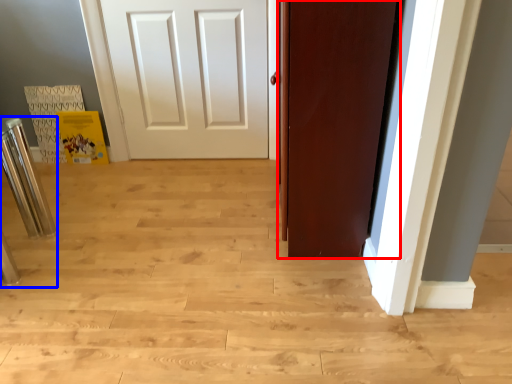
Question: Among these objects, which one is nearest to the camera, door (highlighted by a red box) or bar stool (highlighted by a blue box)?

Choices:
 (A) door
 (B) bar stool

Answer: (A)